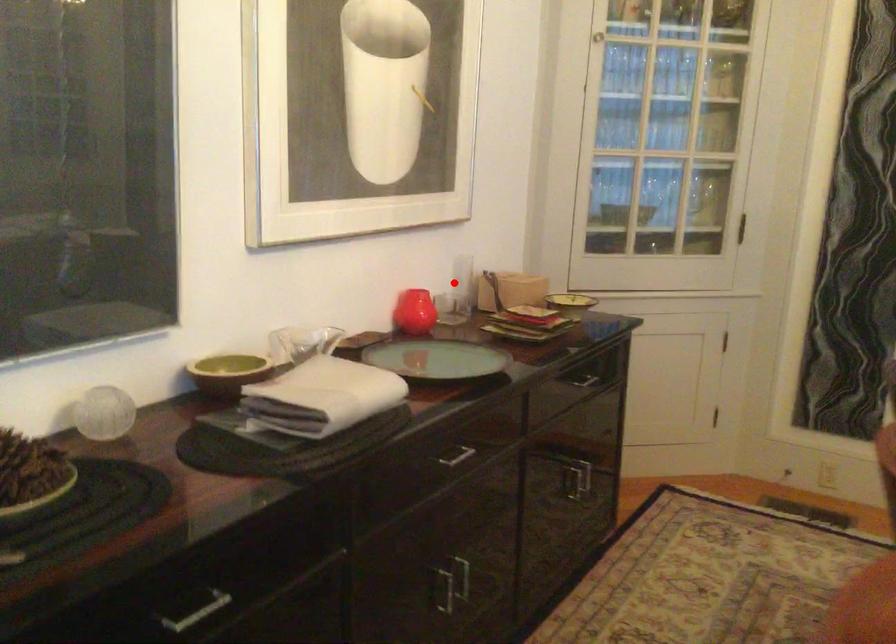
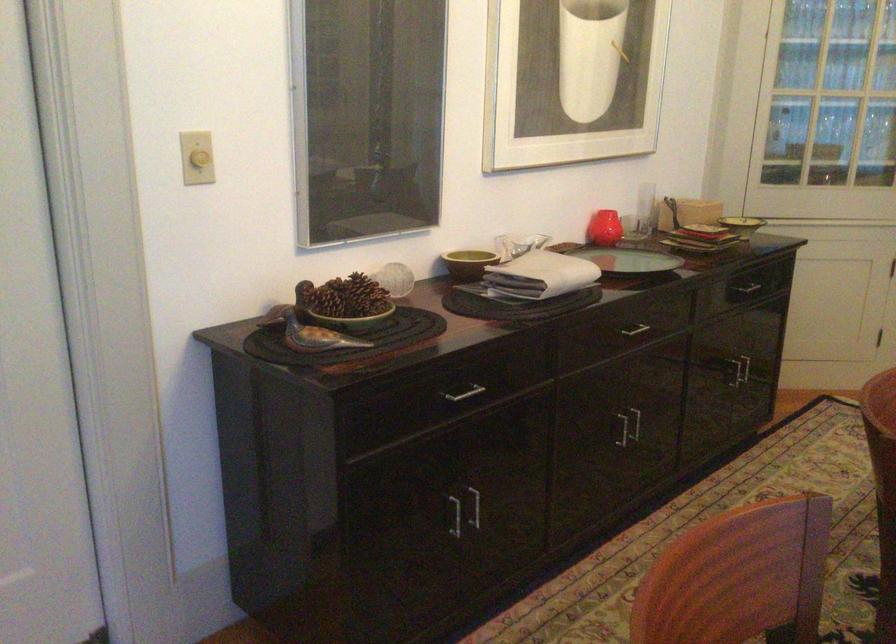
The point at the highlighted location is marked in the first image. Where is the corresponding point in the second image?

(645, 207)